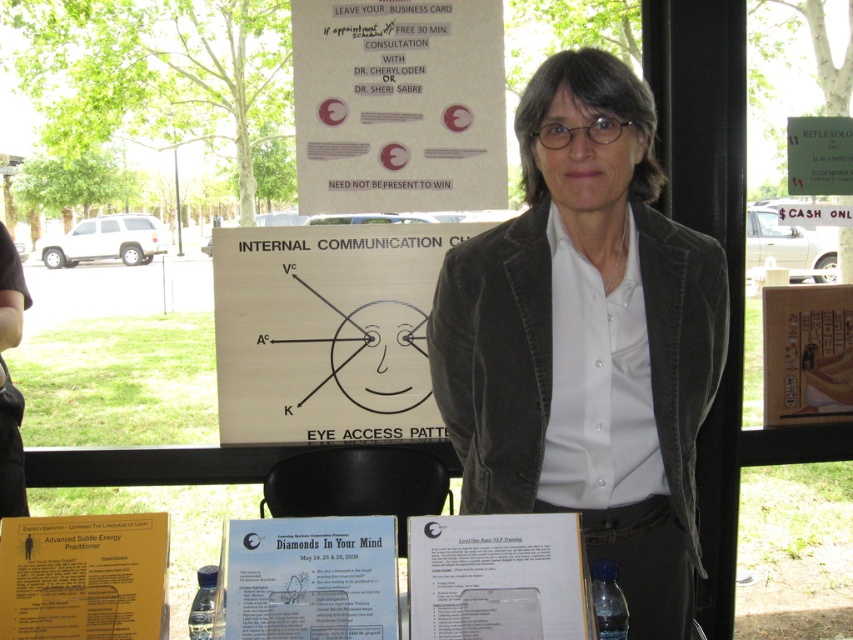
You are organizing a booth and need to know which paper is wider for layout purposes. Which one is wider between the white paper sign at upper center and the yellow paper at lower left?

The white paper sign at upper center is wider than the yellow paper at lower left according to the description.

You are organizing an event and need to place a 1.5 meter long banner between the wooden signboard at center and the white paper poster at upper right. Will there be enough space to fit it without overlapping either object?

The wooden signboard at center and the white paper poster at upper right are 1.42 meters apart. Since the banner is 1.5 meters long, it will not fit between them without overlapping either object.

You are a visitor at this event and want to read both the white paper sign at upper center and the yellow paper at lower left. Which one do you need to look up at first?

The white paper sign at upper center is above the yellow paper at lower left, so you need to look up at the white paper sign at upper center first before looking down at the yellow paper at lower left.